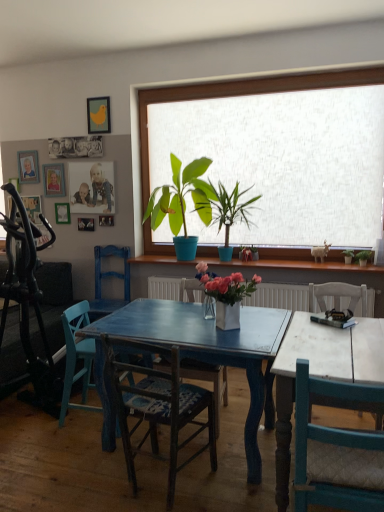
Question: Considering the relative positions of green matte plant at right, arranged as the fifth houseplant when viewed from the front, and wooden chair with woven seat at center, marked as the 4th chair in a back-to-front arrangement, in the image provided, is green matte plant at right, arranged as the fifth houseplant when viewed from the front, to the left or to the right of wooden chair with woven seat at center, marked as the 4th chair in a back-to-front arrangement,?

Choices:
 (A) right
 (B) left

Answer: (A)

Question: Considering the positions of point (344, 248) and point (160, 376), is point (344, 248) closer or farther from the camera than point (160, 376)?

Choices:
 (A) farther
 (B) closer

Answer: (A)

Question: Which of these objects is positioned closest to the green matte plant at right, arranged as the fifth houseplant when viewed from the left?

Choices:
 (A) wooden picture frame at upper left, which is the 3th picture frame in right-to-left order
 (B) wooden photo frame at upper left, the fifth picture frame positioned from the right
 (C) white ceramic vase at center, which is the fourth houseplant from right to left
 (D) teal wood chair at right, the first chair from the front
 (E) green matte plant at right, which ranks as the 2th houseplant in right-to-left order

Answer: (E)

Question: Based on their relative distances, which object is farther from the green matte plant at center, which ranks as the third houseplant in back-to-front order?

Choices:
 (A) blue painted wood chair at left, which appears as the fifth chair when viewed from the front
 (B) blue wood chair at center, the 2th chair viewed from the back
 (C) wooden chair with woven seat at center, marked as the 4th chair in a back-to-front arrangement
 (D) green matte plant at right, the fourth houseplant positioned from the front
 (E) wooden chair at center, placed as the 3th chair when sorted from back to front

Answer: (C)